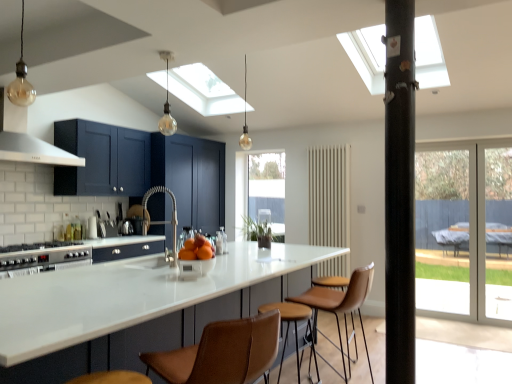
The image size is (512, 384). What do you see at coordinates (399, 191) in the screenshot? I see `black matte pillar at center` at bounding box center [399, 191].

The width and height of the screenshot is (512, 384). Describe the element at coordinates (496, 231) in the screenshot. I see `transparent glass screen door at right, the 2th screen door in the left-to-right sequence` at that location.

Find the location of a particular element. Image resolution: width=512 pixels, height=384 pixels. brown leather chair at center, the 2th chair positioned from the right is located at coordinates (222, 353).

What do you see at coordinates (261, 187) in the screenshot?
I see `clear glass window at center` at bounding box center [261, 187].

Where is `silver metallic stove at lower left`? The width and height of the screenshot is (512, 384). silver metallic stove at lower left is located at coordinates (42, 257).

Between brown leather bar stool at center and translucent glass bulb at center, which appears as the first light fixture when viewed from the back, which one has smaller width?

translucent glass bulb at center, which appears as the first light fixture when viewed from the back.

Is brown leather bar stool at center bigger than translucent glass bulb at center, which is counted as the third light fixture, starting from the front?

Indeed, brown leather bar stool at center has a larger size compared to translucent glass bulb at center, which is counted as the third light fixture, starting from the front.

At what (x,y) coordinates should I click in order to perform the action: click on light fixture that is the 2nd one when counting backward from the brown leather bar stool at center. Please return your answer as a coordinate pair (x, y). This screenshot has height=384, width=512. Looking at the image, I should click on (245, 119).

Would you say brown leather bar stool at center is outside translucent glass bulb at center, which appears as the first light fixture when viewed from the back?

brown leather bar stool at center lies outside translucent glass bulb at center, which appears as the first light fixture when viewed from the back,'s area.

Does translucent glass bulb at upper center, which ranks as the second light fixture in right-to-left order, contain matte blue cabinets at center?

No, matte blue cabinets at center is located outside of translucent glass bulb at upper center, which ranks as the second light fixture in right-to-left order.

Does translucent glass bulb at upper center, acting as the second light fixture starting from the front, have a lesser height compared to matte blue cabinets at center?

Yes, translucent glass bulb at upper center, acting as the second light fixture starting from the front, is shorter than matte blue cabinets at center.

From a real-world perspective, which is physically below, translucent glass bulb at upper center, acting as the second light fixture starting from the front, or matte blue cabinets at center?

matte blue cabinets at center, from a real-world perspective.

From the image's perspective, is translucent glass bulb at upper center, acting as the second light fixture starting from the left, below matte blue cabinets at center?

Incorrect, from the image's perspective, translucent glass bulb at upper center, acting as the second light fixture starting from the left, is higher than matte blue cabinets at center.

What's the angular difference between translucent glass bulb at center, which is counted as the 1th light fixture, starting from the right, and clear glass window at center's facing directions?

translucent glass bulb at center, which is counted as the 1th light fixture, starting from the right, and clear glass window at center are facing 1.29 degrees away from each other.

Which is closer to the camera, (244, 102) or (243, 185)?

The point (244, 102) is more forward.

Who is taller, translucent glass bulb at center, which is counted as the 1th light fixture, starting from the right, or clear glass window at center?

Standing taller between the two is clear glass window at center.

Image resolution: width=512 pixels, height=384 pixels. What are the coordinates of `window lying below the translucent glass bulb at center, marked as the 3th light fixture in a left-to-right arrangement (from the image's perspective)` in the screenshot? It's located at (261, 187).

Is there a large distance between brown leather stool at center, arranged as the second chair when viewed from the left, and transparent glass screen door at right, which is the first screen door from right to left?

That's right, there is a large distance between brown leather stool at center, arranged as the second chair when viewed from the left, and transparent glass screen door at right, which is the first screen door from right to left.

Does brown leather stool at center, the second chair positioned from the front, have a smaller size compared to transparent glass screen door at right, which is the first screen door from right to left?

No.

In terms of height, does brown leather stool at center, which ranks as the first chair in back-to-front order, look taller or shorter compared to transparent glass screen door at right, which is the first screen door from right to left?

Clearly, brown leather stool at center, which ranks as the first chair in back-to-front order, is shorter compared to transparent glass screen door at right, which is the first screen door from right to left.

Is point (353, 327) behind point (499, 305)?

No, it is not.

Is brown leather stool at center, arranged as the second chair when viewed from the left, aimed at translucent glass bulb at upper center, acting as the second light fixture starting from the front?

No.

In the scene shown: Considering the relative sizes of brown leather stool at center, marked as the 1th chair in a right-to-left arrangement, and translucent glass bulb at upper center, which ranks as the second light fixture in right-to-left order, in the image provided, is brown leather stool at center, marked as the 1th chair in a right-to-left arrangement, thinner than translucent glass bulb at upper center, which ranks as the second light fixture in right-to-left order,?

No.

From a real-world perspective, is brown leather stool at center, which ranks as the first chair in back-to-front order, above or below translucent glass bulb at upper center, which ranks as the second light fixture in right-to-left order?

From a real-world perspective, brown leather stool at center, which ranks as the first chair in back-to-front order, is physically below translucent glass bulb at upper center, which ranks as the second light fixture in right-to-left order.

From the image's perspective, is brown leather stool at center, arranged as the second chair when viewed from the left, on top of translucent glass bulb at upper center, which ranks as the second light fixture in right-to-left order?

Incorrect, from the image's perspective, brown leather stool at center, arranged as the second chair when viewed from the left, is lower than translucent glass bulb at upper center, which ranks as the second light fixture in right-to-left order.

Is clear glass window at center located outside brown leather stool at center, marked as the 1th chair in a right-to-left arrangement?

Yes, clear glass window at center is located beyond the bounds of brown leather stool at center, marked as the 1th chair in a right-to-left arrangement.

Does clear glass window at center turn towards brown leather stool at center, which ranks as the first chair in back-to-front order?

No, clear glass window at center is not oriented towards brown leather stool at center, which ranks as the first chair in back-to-front order.

How distant is clear glass window at center from brown leather stool at center, arranged as the second chair when viewed from the left?

8.31 feet.

Who is taller, clear glass window at center or brown leather stool at center, the second chair positioned from the front?

clear glass window at center.

Which is nearer, (x=165, y=140) or (x=246, y=109)?

Point (x=165, y=140) is positioned farther from the camera compared to point (x=246, y=109).

In the scene shown: From a real-world perspective, who is located lower, matte blue cabinets at center or translucent glass bulb at center, which appears as the first light fixture when viewed from the back?

In real-world perspective, matte blue cabinets at center is lower.

Which of these two, matte blue cabinets at center or translucent glass bulb at center, which is counted as the 1th light fixture, starting from the right, is thinner?

translucent glass bulb at center, which is counted as the 1th light fixture, starting from the right.

Where is `cabinetry that appears on the left of translucent glass bulb at center, marked as the 3th light fixture in a left-to-right arrangement`? This screenshot has height=384, width=512. cabinetry that appears on the left of translucent glass bulb at center, marked as the 3th light fixture in a left-to-right arrangement is located at coordinates (191, 178).

This screenshot has width=512, height=384. Identify the location of bar stool below the translucent glass bulb at center, which appears as the first light fixture when viewed from the back (from a real-world perspective). (289, 324).

Locate an element on the screen. The height and width of the screenshot is (384, 512). the 1st light fixture above when counting from the matte blue cabinets at center (from the image's perspective) is located at coordinates (167, 103).

Based on their spatial positions, is translucent glass bulb at upper center, acting as the second light fixture starting from the left, or brown leather bar stool at center further from translucent glass bulb at center, marked as the 3th light fixture in a left-to-right arrangement?

The object further to translucent glass bulb at center, marked as the 3th light fixture in a left-to-right arrangement, is brown leather bar stool at center.

Based on the photo, considering their positions, is black matte pillar at center positioned further to silver metallic stove at lower left than satin silver exhaust hood at upper left?

black matte pillar at center is positioned further to the anchor silver metallic stove at lower left.

Looking at the image, which one is located closer to satin nickel faucet at center, satin silver exhaust hood at upper left or silver metallic stove at lower left?

silver metallic stove at lower left is closer to satin nickel faucet at center.

From the picture: Considering their positions, is black matte pillar at center positioned closer to white glossy countertop at center than orangesmoothbowl at center?

orangesmoothbowl at center is closer to white glossy countertop at center.

Considering their positions, is transparent glass screen door at right, the 2th screen door in the left-to-right sequence, positioned closer to matte blue cabinets at center than white glossy countertop at center?

white glossy countertop at center is closer to matte blue cabinets at center.

Looking at the image, which one is located further to black matte pillar at center, translucent glass bulb at upper center, which ranks as the second light fixture in right-to-left order, or brown leather stool at center, the second chair positioned from the front?

Among the two, translucent glass bulb at upper center, which ranks as the second light fixture in right-to-left order, is located further to black matte pillar at center.

When comparing their distances from matte blue cabinets at center, does black matte pillar at center or white glossy countertop at center seem closer?

white glossy countertop at center is closer to matte blue cabinets at center.

Estimate the real-world distances between objects in this image. Which object is closer to silver metallic stove at lower left, orangesmoothbowl at center or white glossy countertop at center?

Among the two, white glossy countertop at center is located nearer to silver metallic stove at lower left.

The height and width of the screenshot is (384, 512). What are the coordinates of `bar stool located between translucent glass bulb at upper center, which ranks as the second light fixture in right-to-left order, and transparent glass screen door at right, arranged as the 2th screen door when viewed from the right, in the left-right direction` in the screenshot? It's located at (289, 324).

The width and height of the screenshot is (512, 384). Find the location of `orange between translucent glass bulb at upper center, acting as the second light fixture starting from the left, and brown leather bar stool at center vertically`. orange between translucent glass bulb at upper center, acting as the second light fixture starting from the left, and brown leather bar stool at center vertically is located at coordinates (196, 249).

Locate an element on the screen. The height and width of the screenshot is (384, 512). chair between matte glass bulb at upper left, which is the third light fixture from right to left, and brown leather bar stool at center vertically is located at coordinates tap(222, 353).

Identify the location of orange between matte glass bulb at upper left, marked as the third light fixture in a back-to-front arrangement, and brown leather bar stool at center vertically. The image size is (512, 384). (196, 249).